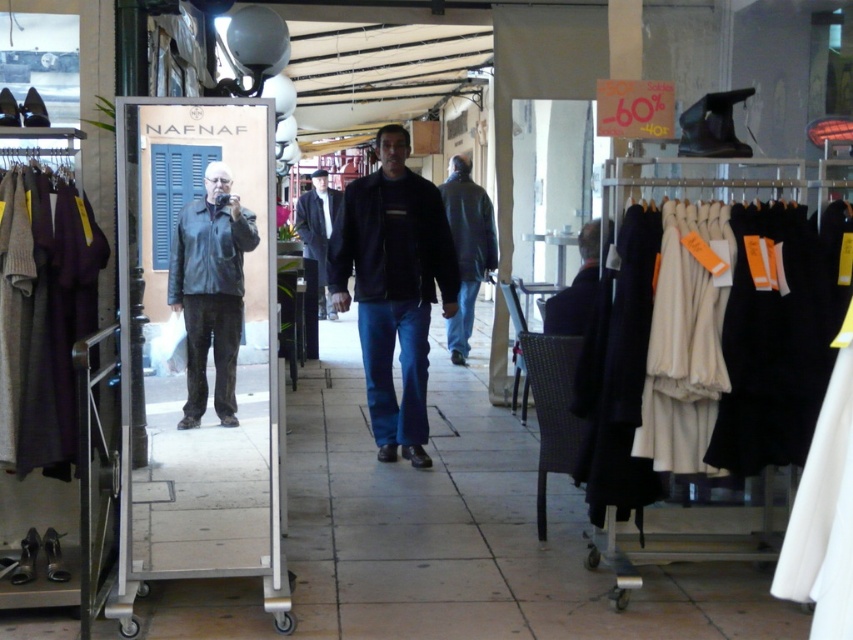
Does leather jacket at left have a larger size compared to dark blue fabric coat at center?

Actually, leather jacket at left might be smaller than dark blue fabric coat at center.

Between point (228, 237) and point (585, 260), which one is positioned behind?

The point (585, 260) is more distant.

This screenshot has width=853, height=640. What are the coordinates of `leather jacket at left` in the screenshot? It's located at (210, 296).

Locate an element on the screen. leather jacket at left is located at coordinates (210, 296).

Is dark purple sweater at left to the right of dark blue fabric coat at center from the viewer's perspective?

Incorrect, dark purple sweater at left is not on the right side of dark blue fabric coat at center.

Who is more distant from viewer, (49, 332) or (581, 269)?

The point (581, 269) is behind.

Consider the image. Who is more distant from viewer, [30,368] or [578,317]?

Point [578,317]

Where is `dark purple sweater at left`? dark purple sweater at left is located at coordinates (44, 314).

Between point (392, 211) and point (195, 371), which one is positioned in front?

Point (195, 371)

Is dark blue denim jeans at center bigger than leather jacket at left?

Yes, dark blue denim jeans at center is bigger than leather jacket at left.

Is point (384, 253) in front of point (189, 282)?

No, (384, 253) is behind (189, 282).

This screenshot has height=640, width=853. What are the coordinates of `dark blue denim jeans at center` in the screenshot? It's located at (393, 288).